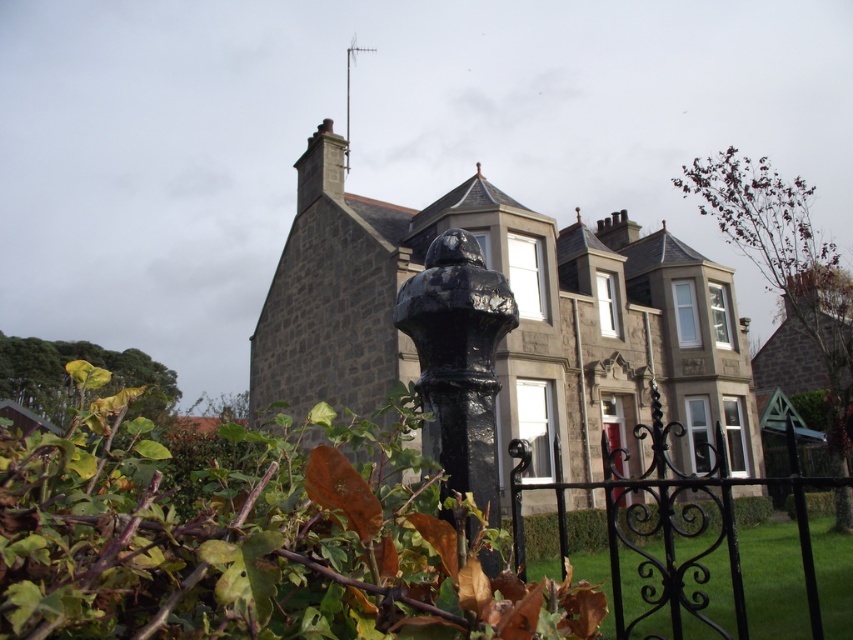
You are standing at the entrance of the property and notice a point marked at coordinates (672, 524). What object is located at this point?

The black wrought iron gate at lower right is located at point (672, 524).

From the picture: You are standing at the entrance of the property and want to walk towards the house. Which object, the black wrought iron gate at lower right or the glossy black post at center, is closer to you?

The black wrought iron gate at lower right is closer to you since the glossy black post at center is positioned behind it.